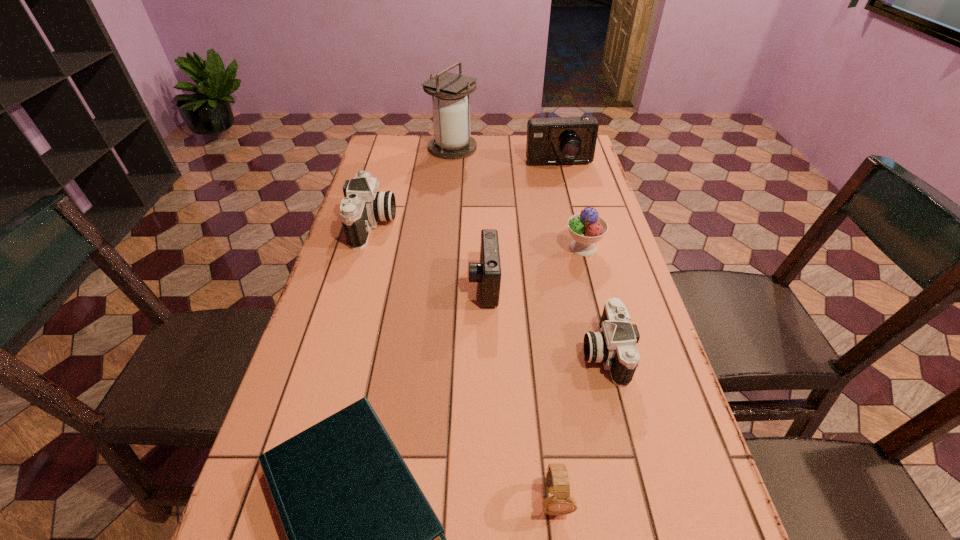
Where is `the tallest object`? the tallest object is located at coordinates (451, 111).

Locate an element on the screen. The height and width of the screenshot is (540, 960). the bigger blue camera is located at coordinates (566, 140).

What are the coordinates of `the farther blue camera` in the screenshot? It's located at (566, 140).

Find the location of a particular element. the bigger black camera is located at coordinates (364, 206).

The width and height of the screenshot is (960, 540). What are the coordinates of `the third nearest camera` in the screenshot? It's located at (364, 206).

Find the location of a particular element. The image size is (960, 540). icecream is located at coordinates (586, 228).

Identify the location of the third camera from right to left. Image resolution: width=960 pixels, height=540 pixels. (x=488, y=271).

Where is `the left blue camera`? the left blue camera is located at coordinates (488, 271).

You are a GUI agent. You are given a task and a screenshot of the screen. Output one action in this format:
    pyautogui.click(x=<x>, y=<y>)
    Task: Click on the nearer black camera
    
    Given the screenshot: What is the action you would take?
    pyautogui.click(x=615, y=345)

The width and height of the screenshot is (960, 540). Find the location of `the nearest camera`. the nearest camera is located at coordinates (615, 345).